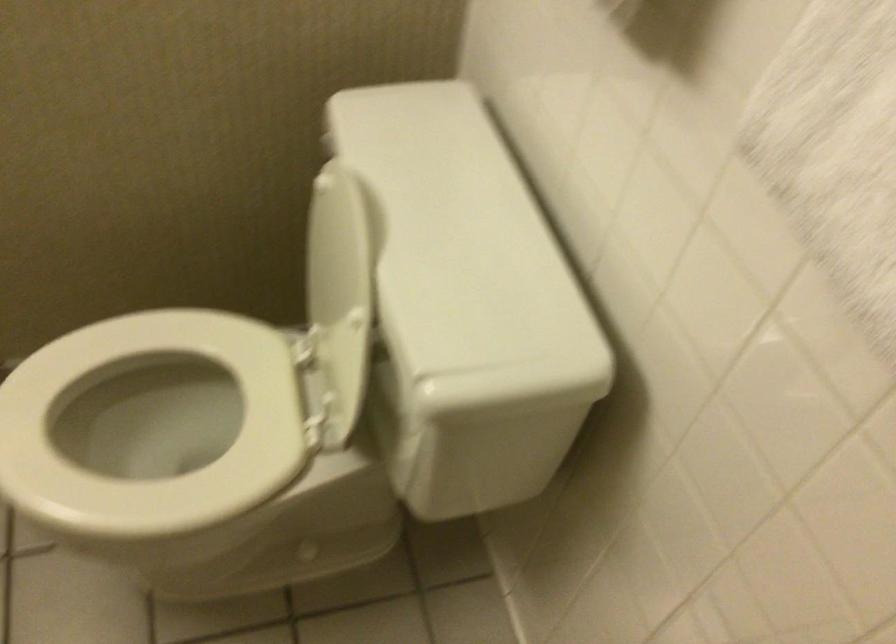
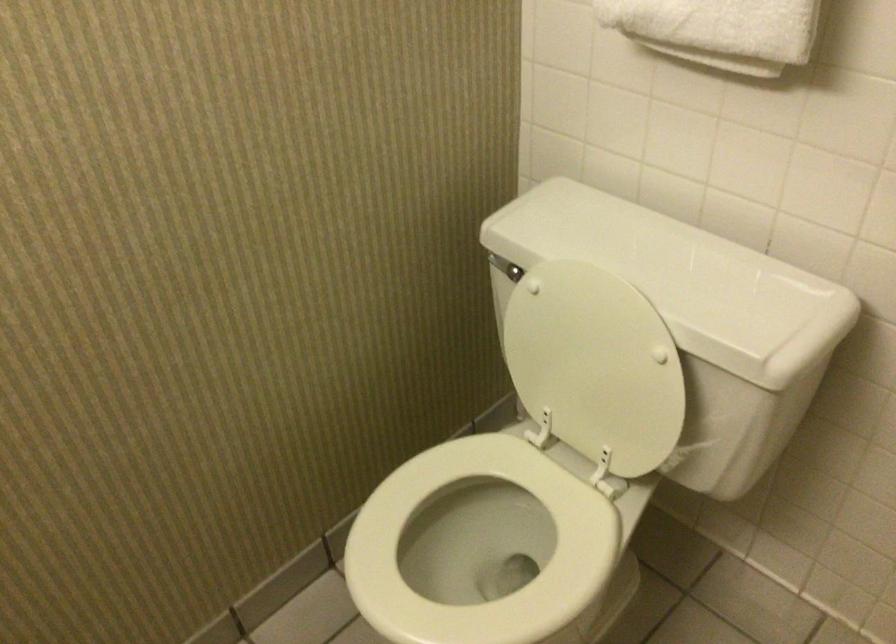
Question: The camera is either moving clockwise (left) or counter-clockwise (right) around the object. The first image is from the beginning of the video and the second image is from the end. Is the camera moving left or right when shooting the video?

Choices:
 (A) Left
 (B) Right

Answer: (A)